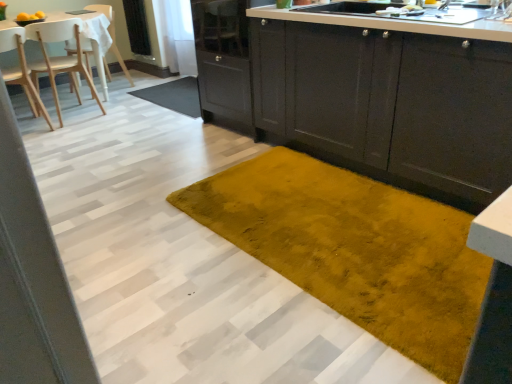
Describe the element at coordinates (60, 57) in the screenshot. I see `wooden chair at left, the 2th chair from the front` at that location.

How much space does white wood chair at upper left, which is counted as the third chair, starting from the front, occupy horizontally?

white wood chair at upper left, which is counted as the third chair, starting from the front, is 53.64 centimeters wide.

The height and width of the screenshot is (384, 512). What do you see at coordinates (354, 249) in the screenshot?
I see `velvet yellow rug at center, the 1th doormat in the front-to-back sequence` at bounding box center [354, 249].

Measure the distance between mustard yellow plush rug at center, which is the second doormat from front to back, and camera.

They are 3.59 meters apart.

What is the approximate height of white glossy countertop at upper center?

It is 7.11 inches.

Find the location of a particular element. The height and width of the screenshot is (384, 512). white glossy countertop at upper center is located at coordinates (394, 24).

The width and height of the screenshot is (512, 384). What do you see at coordinates (444, 5) in the screenshot? I see `metallic silver faucet at upper right` at bounding box center [444, 5].

Where is `metallic silver faucet at upper right`? The image size is (512, 384). metallic silver faucet at upper right is located at coordinates (444, 5).

The image size is (512, 384). What are the coordinates of `transparent glass screen door at upper center` in the screenshot? It's located at (137, 27).

Identify the location of wooden chair at left, placed as the 2th chair when sorted from back to front. The width and height of the screenshot is (512, 384). (60, 57).

Is wooden chair at left, the 2th chair from the front, facing away from transparent glass screen door at upper center?

No.

Considering the relative positions of wooden chair at left, placed as the 2th chair when sorted from back to front, and transparent glass screen door at upper center in the image provided, is wooden chair at left, placed as the 2th chair when sorted from back to front, to the left of transparent glass screen door at upper center from the viewer's perspective?

Indeed, wooden chair at left, placed as the 2th chair when sorted from back to front, is positioned on the left side of transparent glass screen door at upper center.

Is point (80, 69) positioned before point (132, 51)?

Yes, it is.

Is wooden chair at left, placed as the 2th chair when sorted from back to front, touching transparent glass screen door at upper center?

wooden chair at left, placed as the 2th chair when sorted from back to front, and transparent glass screen door at upper center are not in contact.

From a real-world perspective, is matte dark gray cabinets at center positioned above or below wooden chair at left, the 2th chair from the front?

Clearly, from a real-world perspective, matte dark gray cabinets at center is above wooden chair at left, the 2th chair from the front.

Find the location of a particular element. chair that is the 1st object directly below the matte dark gray cabinets at center (from a real-world perspective) is located at coordinates (60, 57).

Is point (326, 115) closer or farther from the camera than point (38, 82)?

Point (326, 115).

Which of these two, matte dark gray cabinets at center or wooden chair at left, placed as the 2th chair when sorted from back to front, is wider?

matte dark gray cabinets at center.

Does wooden chair at left, the 2th chair from the front, turn towards mustard yellow plush rug at center, which is the second doormat from front to back?

No, wooden chair at left, the 2th chair from the front, is not oriented towards mustard yellow plush rug at center, which is the second doormat from front to back.

Does wooden chair at left, placed as the 2th chair when sorted from back to front, have a smaller size compared to mustard yellow plush rug at center, which ranks as the 2th doormat in bottom-to-top order?

No, wooden chair at left, placed as the 2th chair when sorted from back to front, is not smaller than mustard yellow plush rug at center, which ranks as the 2th doormat in bottom-to-top order.

From a real-world perspective, which is physically above, wooden chair at left, the 2th chair from the front, or mustard yellow plush rug at center, which ranks as the 2th doormat in bottom-to-top order?

wooden chair at left, the 2th chair from the front.

Which is closer, [55,94] or [182,78]?

Point [55,94] is closer to the camera than point [182,78].

Looking at this image, considering the sizes of objects white wood chair at upper left, which is counted as the third chair, starting from the front, and white glossy countertop at upper center in the image provided, who is wider, white wood chair at upper left, which is counted as the third chair, starting from the front, or white glossy countertop at upper center?

white glossy countertop at upper center.

Would you say white wood chair at upper left, which is counted as the third chair, starting from the front, is inside or outside white glossy countertop at upper center?

white wood chair at upper left, which is counted as the third chair, starting from the front, is not enclosed by white glossy countertop at upper center.

From the image's perspective, is white wood chair at upper left, the 1th chair viewed from the back, on top of white glossy countertop at upper center?

Correct, white wood chair at upper left, the 1th chair viewed from the back, appears higher than white glossy countertop at upper center in the image.

From a real-world perspective, who is located higher, white wood chair at upper left, the 1th chair viewed from the back, or white glossy countertop at upper center?

white glossy countertop at upper center.

Considering the relative sizes of white wood chair at upper left, the 1th chair viewed from the back, and light wood chair at left, which is the 1th chair in front-to-back order, in the image provided, is white wood chair at upper left, the 1th chair viewed from the back, taller than light wood chair at left, which is the 1th chair in front-to-back order,?

No.

Is light wood chair at left, which is the 1th chair in front-to-back order, inside white wood chair at upper left, which is counted as the third chair, starting from the front?

No, light wood chair at left, which is the 1th chair in front-to-back order, is not inside white wood chair at upper left, which is counted as the third chair, starting from the front.

Is white wood chair at upper left, the 1th chair viewed from the back, to the left or to the right of light wood chair at left, which is the 1th chair in front-to-back order, in the image?

white wood chair at upper left, the 1th chair viewed from the back, is positioned on light wood chair at left, which is the 1th chair in front-to-back order,'s right side.

Considering the relative sizes of white wood chair at upper left, which is counted as the third chair, starting from the front, and light wood chair at left, which is the 1th chair in front-to-back order, in the image provided, is white wood chair at upper left, which is counted as the third chair, starting from the front, thinner than light wood chair at left, which is the 1th chair in front-to-back order,?

Yes.

Which doormat is the 2nd one when counting from the left side of the metallic silver faucet at upper right? Please provide its 2D coordinates.

[(174, 96)]

How far apart are mustard yellow plush rug at center, which ranks as the 2th doormat in bottom-to-top order, and metallic silver faucet at upper right?

They are 8.71 feet apart.

Is point (195, 100) positioned before point (449, 2)?

No, it is behind (449, 2).

Does mustard yellow plush rug at center, the 1th doormat when ordered from back to front, have a greater height compared to metallic silver faucet at upper right?

Incorrect, the height of mustard yellow plush rug at center, the 1th doormat when ordered from back to front, is not larger of that of metallic silver faucet at upper right.

Which chair is the 2nd one when counting from the back of the velvet yellow rug at center, which is counted as the 2th doormat, starting from the top? Please provide its 2D coordinates.

[(60, 57)]

From a real-world perspective, does velvet yellow rug at center, the 1th doormat in the front-to-back sequence, stand above wooden chair at left, the 2th chair from the front?

No.

Is the position of velvet yellow rug at center, acting as the 1th doormat starting from the bottom, less distant than that of wooden chair at left, the 2th chair from the front?

Yes, velvet yellow rug at center, acting as the 1th doormat starting from the bottom, is in front of wooden chair at left, the 2th chair from the front.

Is velvet yellow rug at center, which is counted as the 2th doormat, starting from the top, far from wooden chair at left, placed as the 2th chair when sorted from back to front?

Yes.

I want to click on screen door located above the wooden chair at left, the 2th chair from the front (from the image's perspective), so click(x=137, y=27).

The image size is (512, 384). What are the coordinates of `cabinetry that is in front of the wooden chair at left, the 2th chair from the front` in the screenshot? It's located at (390, 102).

Which object lies nearer to the anchor point matte dark gray cabinets at center, light wood chair at left, which is the 1th chair in front-to-back order, or white glossy countertop at upper center?

Based on the image, white glossy countertop at upper center appears to be nearer to matte dark gray cabinets at center.

Based on their spatial positions, is mustard yellow plush rug at center, which ranks as the 2th doormat in bottom-to-top order, or velvet yellow rug at center, marked as the second doormat in a back-to-front arrangement, closer to light wood chair at left, which is the 1th chair in front-to-back order?

mustard yellow plush rug at center, which ranks as the 2th doormat in bottom-to-top order, is positioned closer to the anchor light wood chair at left, which is the 1th chair in front-to-back order.

When comparing their distances from transparent glass screen door at upper center, does velvet yellow rug at center, the 1th doormat in the front-to-back sequence, or matte dark gray cabinets at center seem further?

The object further to transparent glass screen door at upper center is velvet yellow rug at center, the 1th doormat in the front-to-back sequence.

When comparing their distances from white glossy countertop at upper center, does metallic silver faucet at upper right or velvet yellow rug at center, which is counted as the 2th doormat, starting from the top, seem closer?

metallic silver faucet at upper right lies closer to white glossy countertop at upper center than the other object.

Consider the image. From the image, which object appears to be farther from white glossy countertop at upper center, metallic silver faucet at upper right or wooden chair at left, the 2th chair from the front?

Among the two, wooden chair at left, the 2th chair from the front, is located further to white glossy countertop at upper center.

When comparing their distances from wooden chair at left, placed as the 2th chair when sorted from back to front, does metallic silver faucet at upper right or light wood chair at left, positioned as the 3th chair in back-to-front order, seem further?

metallic silver faucet at upper right is positioned further to the anchor wooden chair at left, placed as the 2th chair when sorted from back to front.

Estimate the real-world distances between objects in this image. Which object is further from wooden chair at left, placed as the 2th chair when sorted from back to front, white wood chair at upper left, the 1th chair viewed from the back, or mustard yellow plush rug at center, which is the second doormat from front to back?

white wood chair at upper left, the 1th chair viewed from the back, is positioned further to the anchor wooden chair at left, placed as the 2th chair when sorted from back to front.

Estimate the real-world distances between objects in this image. Which object is closer to metallic silver faucet at upper right, mustard yellow plush rug at center, which is the second doormat from front to back, or light wood chair at left, which is the 1th chair in front-to-back order?

mustard yellow plush rug at center, which is the second doormat from front to back.

In order to click on doormat between matte dark gray cabinets at center and transparent glass screen door at upper center from front to back in this screenshot , I will do `click(174, 96)`.

Image resolution: width=512 pixels, height=384 pixels. Find the location of `faucet located between matte dark gray cabinets at center and mustard yellow plush rug at center, which is the second doormat from front to back, in the depth direction`. faucet located between matte dark gray cabinets at center and mustard yellow plush rug at center, which is the second doormat from front to back, in the depth direction is located at coordinates (444, 5).

Where is `countertop between wooden chair at left, placed as the 2th chair when sorted from back to front, and metallic silver faucet at upper right from left to right`? countertop between wooden chair at left, placed as the 2th chair when sorted from back to front, and metallic silver faucet at upper right from left to right is located at coordinates (394, 24).

At what (x,y) coordinates should I click in order to perform the action: click on cabinetry located between velvet yellow rug at center, the 1th doormat in the front-to-back sequence, and white wood chair at upper left, the 1th chair viewed from the back, in the depth direction. Please return your answer as a coordinate pair (x, y). Looking at the image, I should click on (390, 102).